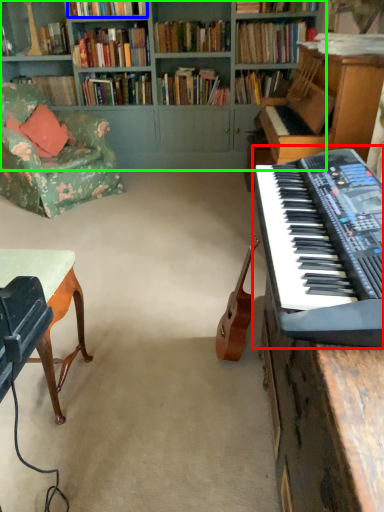
Question: Which is farther away from musical keyboard (highlighted by a red box)? book (highlighted by a blue box) or bookcase (highlighted by a green box)?

Choices:
 (A) book
 (B) bookcase

Answer: (A)